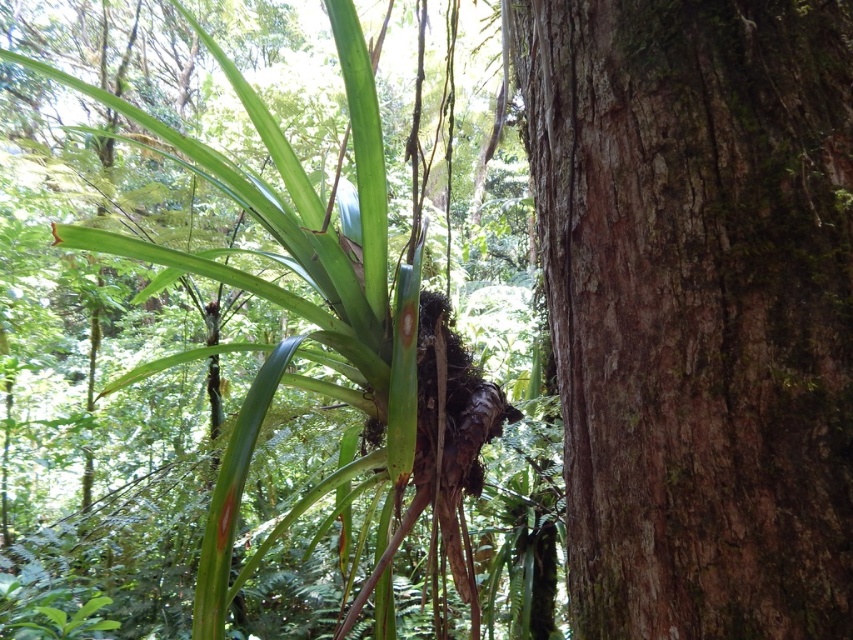
Does brown rough bark at right have a greater height compared to green rough bark tree at center?

Incorrect, brown rough bark at right's height is not larger of green rough bark tree at center's.

Identify the location of brown rough bark at right. (697, 307).